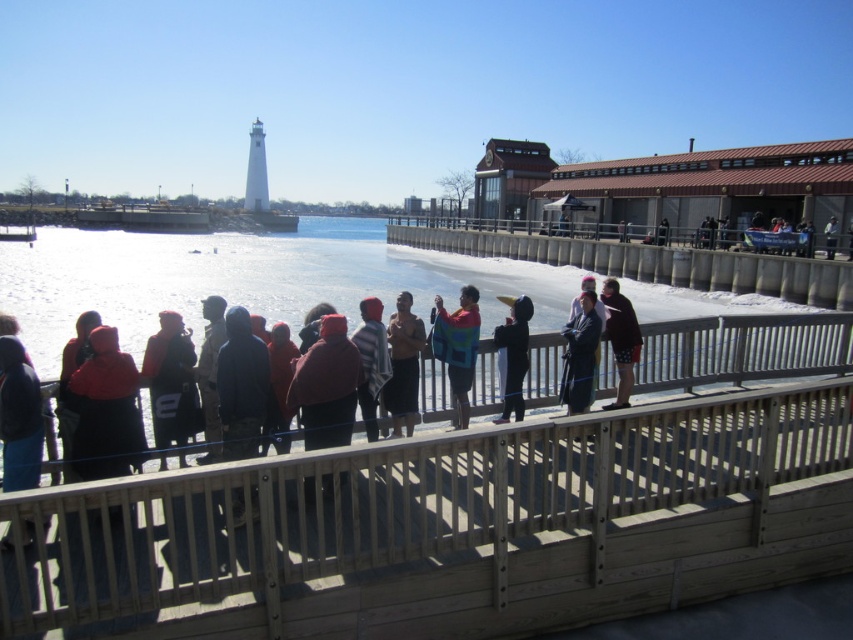
Question: Which point appears closest to the camera in this image?

Choices:
 (A) (521, 356)
 (B) (450, 392)
 (C) (82, 381)

Answer: (C)

Question: Where is knitted multicolored sweater at center located in relation to dark blue fabric at center in the image?

Choices:
 (A) left
 (B) right

Answer: (A)

Question: Can you confirm if matte black jacket at center is positioned above dark blue fabric at center?

Choices:
 (A) no
 (B) yes

Answer: (A)

Question: Which point is farther to the camera?

Choices:
 (A) black fabric jacket at center
 (B) matte black jacket at center
 (C) dark gray jacket at center

Answer: (C)

Question: Observing the image, what is the correct spatial positioning of matte black jacket at center in reference to dark gray jacket at center?

Choices:
 (A) above
 (B) below

Answer: (B)

Question: Which object is the farthest from the dark gray jacket at center?

Choices:
 (A) shiny metallic tank top at center
 (B) striped sweater at center
 (C) black fabric jacket at center
 (D) matte black jacket at center

Answer: (D)